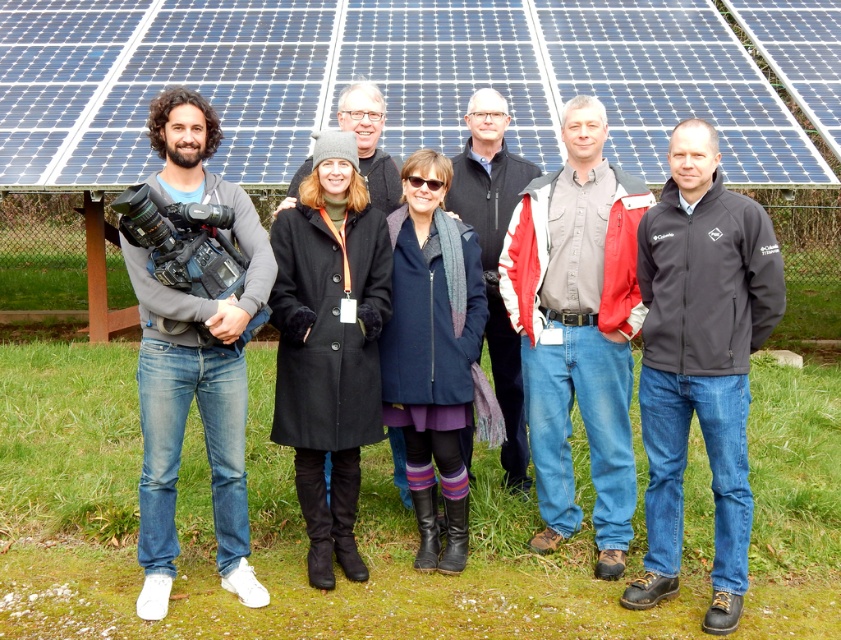
Can you confirm if matte black camera at left is taller than black softshell jacket at center?

Yes.

Which is behind, point (173, 317) or point (475, 132)?

The point (475, 132) is more distant.

This screenshot has width=841, height=640. Find the location of `matte black camera at left`. matte black camera at left is located at coordinates (194, 364).

Does dark gray softshell jacket at center appear over black softshell jacket at center?

Actually, dark gray softshell jacket at center is below black softshell jacket at center.

Can you confirm if dark gray softshell jacket at center is bigger than black softshell jacket at center?

Yes.

Is point (739, 435) positioned before point (517, 179)?

Yes, point (739, 435) is in front of point (517, 179).

Find the location of a particular element. The width and height of the screenshot is (841, 640). dark gray softshell jacket at center is located at coordinates (701, 362).

Is dark gray softshell jacket at center positioned in front of black wool coat at center?

Yes, it is.

Looking at this image, who is more distant from viewer, (680, 195) or (291, 204)?

Positioned behind is point (291, 204).

Does point (685, 200) come in front of point (361, 147)?

That is True.

Find the location of `dark gray softshell jacket at center`. dark gray softshell jacket at center is located at coordinates (701, 362).